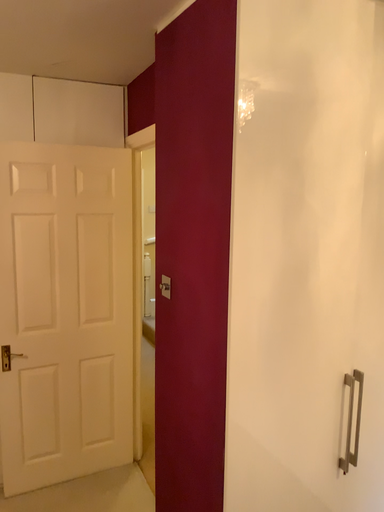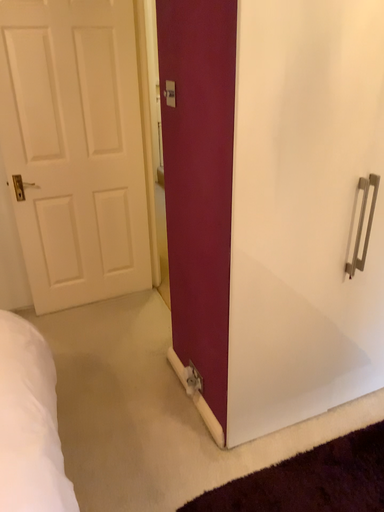
Question: How did the camera likely rotate when shooting the video?

Choices:
 (A) rotated downward
 (B) rotated upward

Answer: (A)